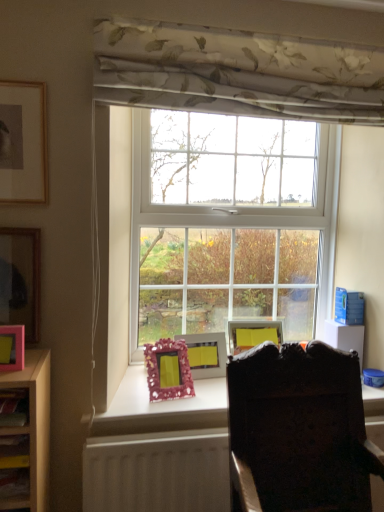
At what (x,y) coordinates should I click in order to perform the action: click on vacant position to the left of pink glittery picture frame at center, which ranks as the 2th picture frame in back-to-front order. Please return your answer as a coordinate pair (x, y). The width and height of the screenshot is (384, 512). Looking at the image, I should click on (130, 388).